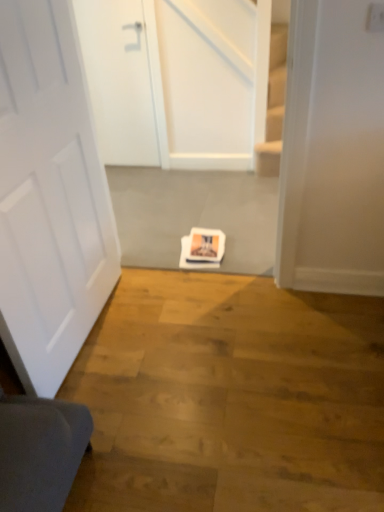
This screenshot has width=384, height=512. I want to click on unoccupied region to the right of white matte door at center, the second door when ordered from back to front, so click(x=169, y=333).